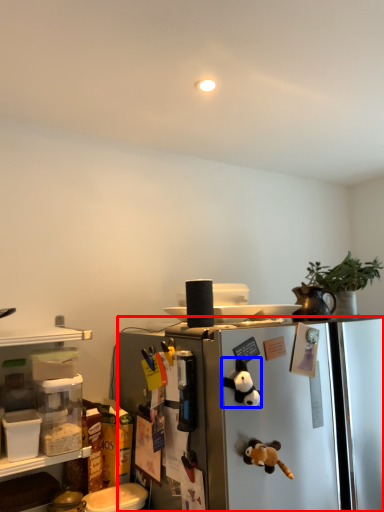
Question: Among these objects, which one is farthest to the camera, refrigerator (highlighted by a red box) or toy (highlighted by a blue box)?

Choices:
 (A) refrigerator
 (B) toy

Answer: (B)